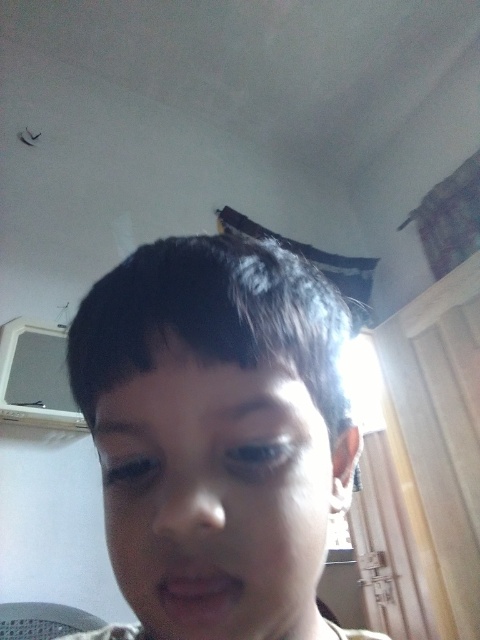
Based on the scene description, can you determine if the smooth skin face at center is covering part of the dark brown hair at upper center?

The smooth skin face at center is in front of dark brown hair at upper center, so yes, the smooth skin face at center is covering part of the dark brown hair at upper center.

Based on the scene description, where is the smooth skin face at center located in terms of coordinates?

The smooth skin face at center is located at coordinates point [216,500].

You are a photographer adjusting the lighting in the room. You notice the smooth skin face at center and the dark brown hair at upper center. Which object is located to the right of the other?

The smooth skin face at center is positioned on the right side of dark brown hair at upper center.